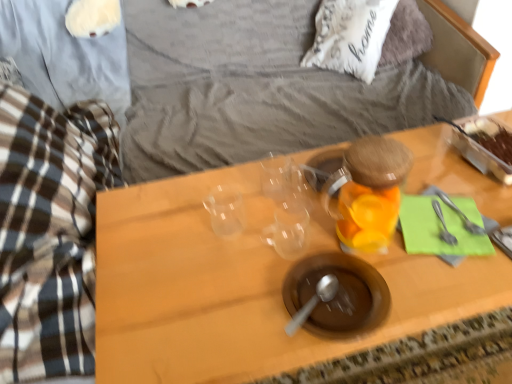
Find the location of a particular element. This screenshot has width=512, height=384. vacant space behind silver metallic fork at right, which ranks as the 1th silverware in left-to-right order is located at coordinates (430, 182).